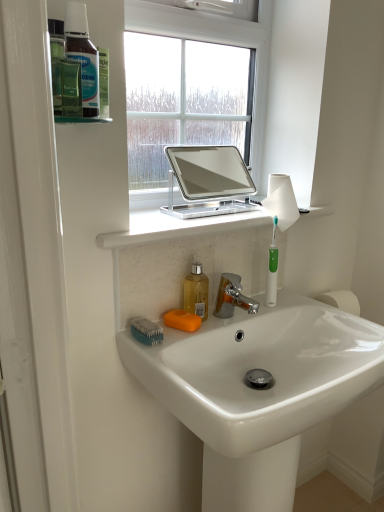
Find the location of a particular element. This screenshot has width=384, height=512. vacant area that is situated to the right of green plastic toothbrush at right is located at coordinates coord(322,311).